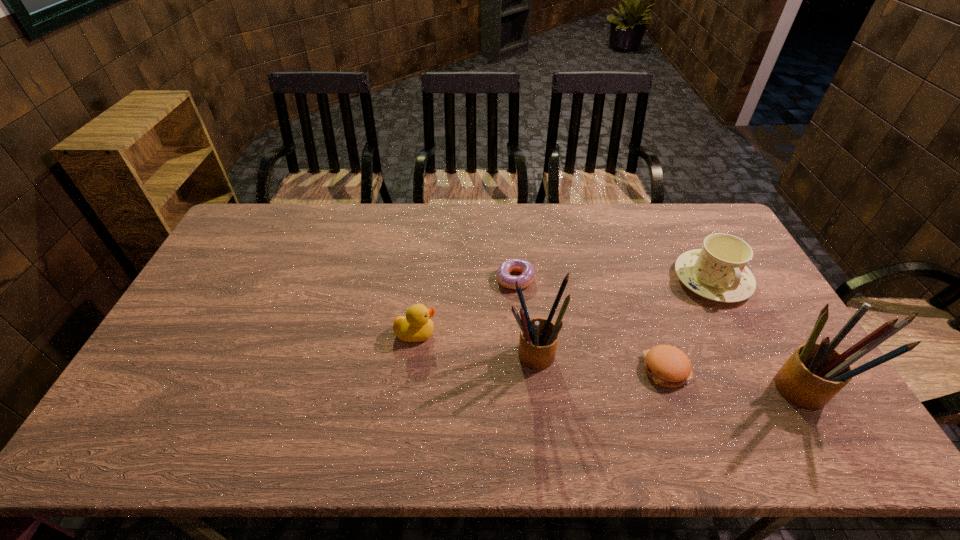
Observe the arrangement of all pencil boxs in the image. To keep them evenly spaced, where would you place another pencil box on the left? Please locate a free space. Please provide its 2D coordinates. Your answer should be formatted as a tuple, i.e. [(x, y)], where the tuple contains the x and y coordinates of a point satisfying the conditions above.

[(300, 322)]